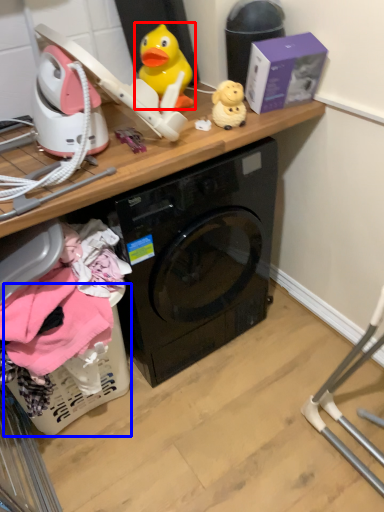
Question: Which of the following is the closest to the observer, toy (highlighted by a red box) or basket (highlighted by a blue box)?

Choices:
 (A) toy
 (B) basket

Answer: (B)